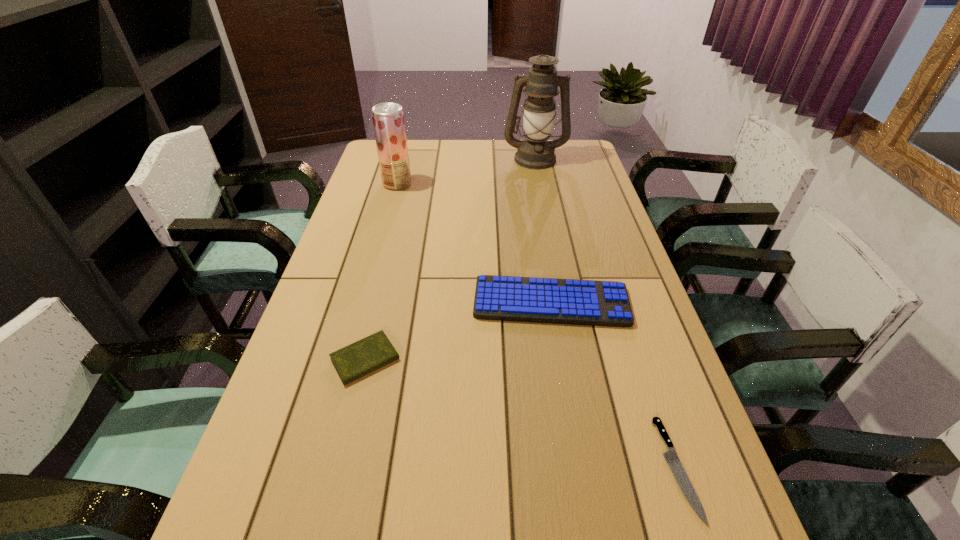
The height and width of the screenshot is (540, 960). I want to click on vacant area between the fruit juice and the fourth tallest object, so click(x=381, y=271).

The image size is (960, 540). Find the location of `free space that is in between the computer keyboard and the diary`. free space that is in between the computer keyboard and the diary is located at coordinates (458, 331).

Find the location of a particular element. empty space that is in between the third tallest object and the fourth tallest object is located at coordinates (458, 331).

Identify the location of vacant area that lies between the fourth shortest object and the third tallest object. The image size is (960, 540). (474, 243).

Locate an element on the screen. The width and height of the screenshot is (960, 540). vacant area that lies between the nearest object and the third farthest object is located at coordinates (613, 386).

You are a GUI agent. You are given a task and a screenshot of the screen. Output one action in this format:
    pyautogui.click(x=<x>, y=<y>)
    Task: Click on the object that is the closest to the shortest object
    This screenshot has height=540, width=960.
    Given the screenshot: What is the action you would take?
    pyautogui.click(x=505, y=298)

Identify which object is the second closest to the oil lamp. Please provide its 2D coordinates. Your answer should be formatted as a tuple, i.e. [(x, y)], where the tuple contains the x and y coordinates of a point satisfying the conditions above.

[(505, 298)]

In order to click on vacant space that satisfies the following two spatial constraints: 1. on the front side of the tallest object; 2. on the right side of the steak knife in this screenshot , I will do `click(596, 468)`.

Image resolution: width=960 pixels, height=540 pixels. In order to click on free space that satisfies the following two spatial constraints: 1. on the back side of the farthest object; 2. on the right side of the fruit juice in this screenshot , I will do `click(404, 158)`.